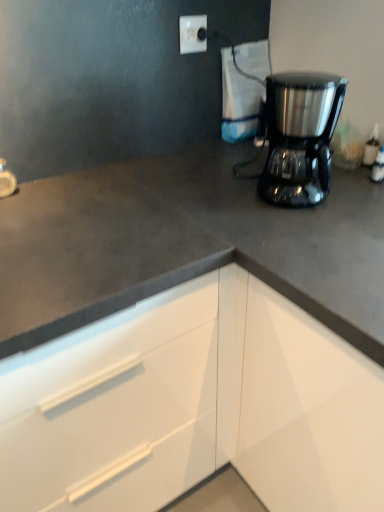
At what (x,y) coordinates should I click in order to perform the action: click on free space in front of satin black coffee maker at upper right. Please return your answer as a coordinate pair (x, y). Looking at the image, I should click on (271, 224).